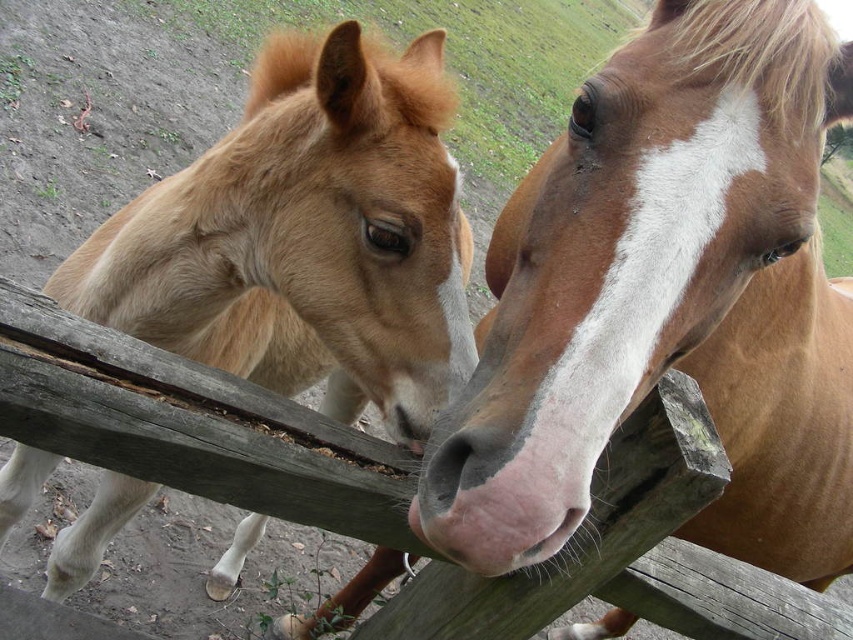
Does brown glossy horse at center have a smaller size compared to wooden fence at center?

No, brown glossy horse at center is not smaller than wooden fence at center.

Can you confirm if brown glossy horse at center is bigger than wooden fence at center?

Correct, brown glossy horse at center is larger in size than wooden fence at center.

The image size is (853, 640). What are the coordinates of `brown glossy horse at center` in the screenshot? It's located at (666, 298).

Is light brown fur at left positioned before wooden fence at center?

That is False.

Based on the photo, is light brown fur at left smaller than wooden fence at center?

No.

In the scene shown: Measure the distance between light brown fur at left and camera.

33.90 inches

Image resolution: width=853 pixels, height=640 pixels. I want to click on light brown fur at left, so click(306, 236).

Which is more to the right, brown glossy horse at center or light brown fur at left?

brown glossy horse at center

I want to click on brown glossy horse at center, so (x=666, y=298).